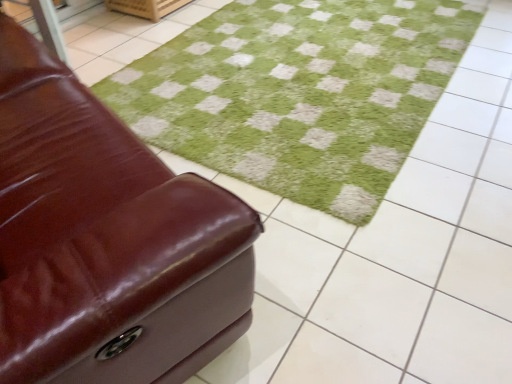
Question: Does shiny brown leather ottoman at left have a lesser width compared to green soft rug at center?

Choices:
 (A) yes
 (B) no

Answer: (A)

Question: From a real-world perspective, is shiny brown leather ottoman at left positioned under green soft rug at center based on gravity?

Choices:
 (A) yes
 (B) no

Answer: (B)

Question: Could you tell me if shiny brown leather ottoman at left is facing green soft rug at center?

Choices:
 (A) no
 (B) yes

Answer: (B)

Question: Can you confirm if shiny brown leather ottoman at left is wider than green soft rug at center?

Choices:
 (A) yes
 (B) no

Answer: (B)

Question: Is shiny brown leather ottoman at left smaller than green soft rug at center?

Choices:
 (A) yes
 (B) no

Answer: (B)

Question: Is shiny brown leather ottoman at left positioned with its back to green soft rug at center?

Choices:
 (A) no
 (B) yes

Answer: (A)

Question: From a real-world perspective, is green soft rug at center on top of shiny brown leather ottoman at left?

Choices:
 (A) no
 (B) yes

Answer: (A)

Question: From the image's perspective, would you say green soft rug at center is shown under shiny brown leather ottoman at left?

Choices:
 (A) yes
 (B) no

Answer: (B)

Question: Is green soft rug at center at the left side of shiny brown leather ottoman at left?

Choices:
 (A) no
 (B) yes

Answer: (A)

Question: From a real-world perspective, does green soft rug at center sit lower than shiny brown leather ottoman at left?

Choices:
 (A) yes
 (B) no

Answer: (A)

Question: Is shiny brown leather ottoman at left located within green soft rug at center?

Choices:
 (A) yes
 (B) no

Answer: (B)

Question: Considering the relative positions of green soft rug at center and shiny brown leather ottoman at left in the image provided, is green soft rug at center to the right of shiny brown leather ottoman at left from the viewer's perspective?

Choices:
 (A) no
 (B) yes

Answer: (B)

Question: From a real-world perspective, is green soft rug at center physically located above or below shiny brown leather ottoman at left?

Choices:
 (A) above
 (B) below

Answer: (B)